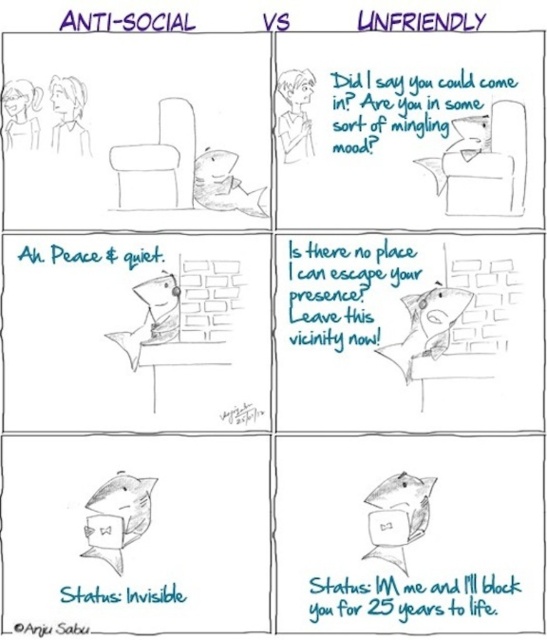
Is white paper text at upper center to the left of black text at lower right from the viewer's perspective?

Incorrect, white paper text at upper center is not on the left side of black text at lower right.

Which is in front, point (376, 129) or point (387, 612)?

Point (387, 612) is in front.

What are the coordinates of `white paper text at upper center` in the screenshot? It's located at (404, 106).

Does white paper text at upper center appear over anti-social text at upper left?

Actually, white paper text at upper center is below anti-social text at upper left.

Find the location of a particular element. white paper text at upper center is located at coordinates (404, 106).

The height and width of the screenshot is (640, 547). What are the coordinates of `white paper text at upper center` in the screenshot? It's located at (404, 106).

Between black paper at center and black handwritten text at center, which one appears on the left side from the viewer's perspective?

Positioned to the left is black handwritten text at center.

Is black paper at center positioned behind black handwritten text at center?

That is False.

This screenshot has width=547, height=640. What do you see at coordinates (346, 289) in the screenshot?
I see `black paper at center` at bounding box center [346, 289].

Where is `black paper at center`? black paper at center is located at coordinates (346, 289).